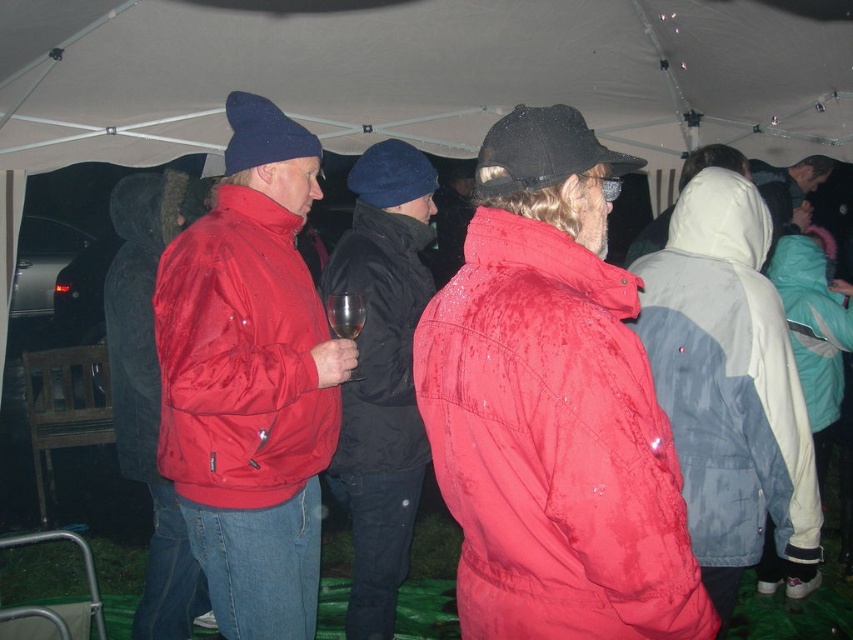
You are standing at the origin point in the image and want to locate the black matte jacket at center. Which direction should you move to find it?

The black matte jacket at center is located at the coordinates 0.533 on the x axis and 0.447 on the y axis, so you should move to the right and slightly forward to reach it.

You are a photographer at the event and want to capture both the black matte jacket at center and the teal fleece jacket at right in a single photo. Given that your camera has a focal length of 50mm and a sensor size of 24mm x 36mm, can you estimate whether the two jackets are within the camera sensor field of view? Please consider the distance between them and the camera specifications provided.

The distance between the black matte jacket at center and the teal fleece jacket at right is 4.76 feet. With a 50mm focal length and a sensor size of 24mm x 36mm, the horizontal field of view is approximately 38 degrees, covering about 6.2 feet at a typical shooting distance. Since 4.76 feet is less than 6.2 feet, the two jackets are likely within the camera sensor field of view.